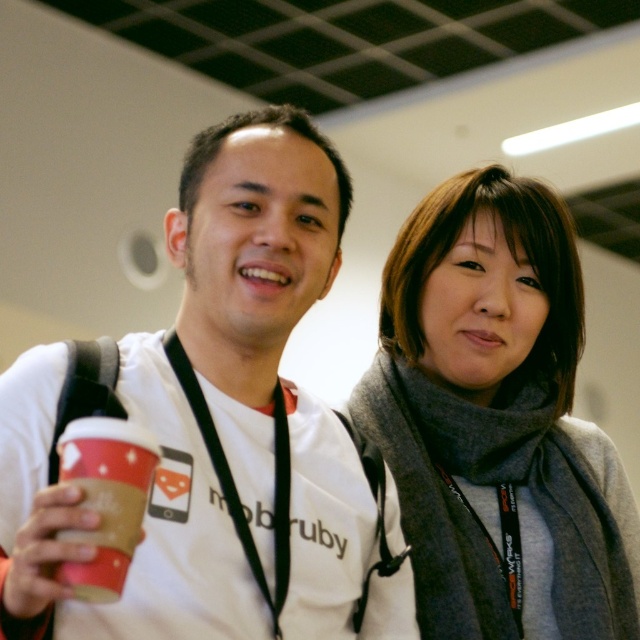
Question: Among these objects, which one is farthest from the camera?

Choices:
 (A) gray wool scarf at upper right
 (B) brown paper cup at left
 (C) white matte t-shirt at center

Answer: (A)

Question: Can you confirm if white matte t-shirt at center is wider than brown paper cup at left?

Choices:
 (A) no
 (B) yes

Answer: (B)

Question: Estimate the real-world distances between objects in this image. Which object is closer to the brown paper cup at left?

Choices:
 (A) white matte t-shirt at center
 (B) gray wool scarf at upper right

Answer: (A)

Question: Is gray wool scarf at upper right thinner than brown paper cup at left?

Choices:
 (A) yes
 (B) no

Answer: (B)

Question: Can you confirm if white matte t-shirt at center is positioned to the right of gray wool scarf at upper right?

Choices:
 (A) no
 (B) yes

Answer: (A)

Question: Among these objects, which one is farthest from the camera?

Choices:
 (A) white matte t-shirt at center
 (B) brown paper cup at left
 (C) gray wool scarf at upper right

Answer: (C)